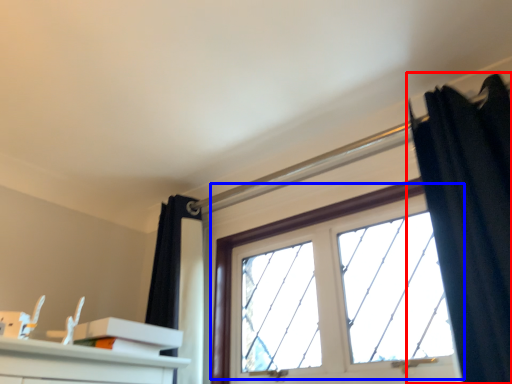
Question: Among these objects, which one is nearest to the camera, curtain (highlighted by a red box) or window (highlighted by a blue box)?

Choices:
 (A) curtain
 (B) window

Answer: (A)